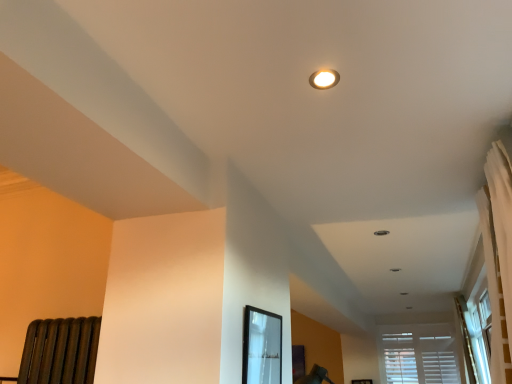
Question: Is the position of matte black frame at center more distant than that of white wood blinds at lower right?

Choices:
 (A) no
 (B) yes

Answer: (A)

Question: Is matte black frame at center facing towards white wood blinds at lower right?

Choices:
 (A) yes
 (B) no

Answer: (B)

Question: Does matte black frame at center have a larger size compared to white wood blinds at lower right?

Choices:
 (A) yes
 (B) no

Answer: (B)

Question: Does matte black frame at center appear on the left side of white wood blinds at lower right?

Choices:
 (A) no
 (B) yes

Answer: (B)

Question: Does matte black frame at center have a lesser height compared to white wood blinds at lower right?

Choices:
 (A) yes
 (B) no

Answer: (A)

Question: From a real-world perspective, relative to matte white light fixture at upper center, is matte black frame at center vertically above or below?

Choices:
 (A) above
 (B) below

Answer: (B)

Question: Choose the correct answer: Is matte black frame at center inside matte white light fixture at upper center or outside it?

Choices:
 (A) inside
 (B) outside

Answer: (B)

Question: Considering the positions of matte black frame at center and matte white light fixture at upper center in the image, is matte black frame at center wider or thinner than matte white light fixture at upper center?

Choices:
 (A) thin
 (B) wide

Answer: (A)

Question: Relative to matte white light fixture at upper center, is matte black frame at center in front or behind?

Choices:
 (A) front
 (B) behind

Answer: (B)

Question: Is matte black frame at center inside the boundaries of white wood blinds at lower right, or outside?

Choices:
 (A) inside
 (B) outside

Answer: (B)

Question: Is matte black frame at center taller or shorter than white wood blinds at lower right?

Choices:
 (A) short
 (B) tall

Answer: (A)

Question: Considering their positions, is matte black frame at center located in front of or behind white wood blinds at lower right?

Choices:
 (A) behind
 (B) front

Answer: (B)

Question: Based on their positions, is matte black frame at center located to the left or right of white wood blinds at lower right?

Choices:
 (A) right
 (B) left

Answer: (B)

Question: In terms of size, does white wood blinds at lower right appear bigger or smaller than matte black frame at center?

Choices:
 (A) small
 (B) big

Answer: (B)

Question: From the image's perspective, is white wood blinds at lower right above or below matte black frame at center?

Choices:
 (A) below
 (B) above

Answer: (A)